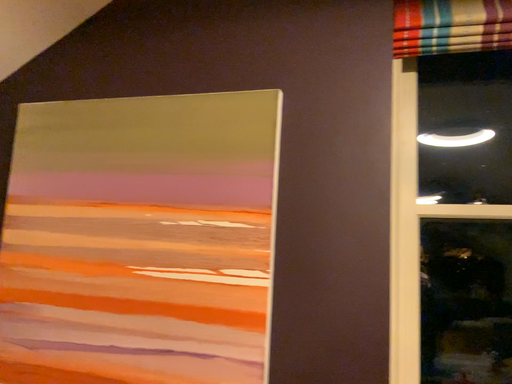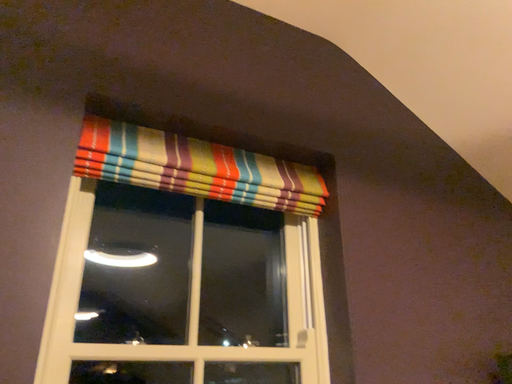
Question: How did the camera likely rotate when shooting the video?

Choices:
 (A) rotated left
 (B) rotated right

Answer: (B)